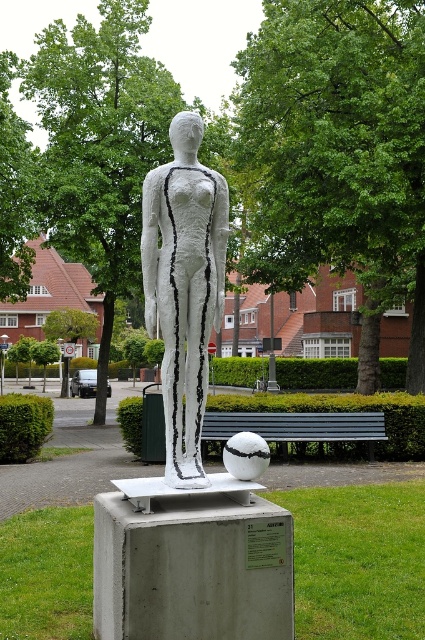
Does white matte sculpture at center lie behind black wooden bench at center?

No.

Which is above, white matte sculpture at center or black wooden bench at center?

white matte sculpture at center

The image size is (425, 640). I want to click on white matte sculpture at center, so click(184, 285).